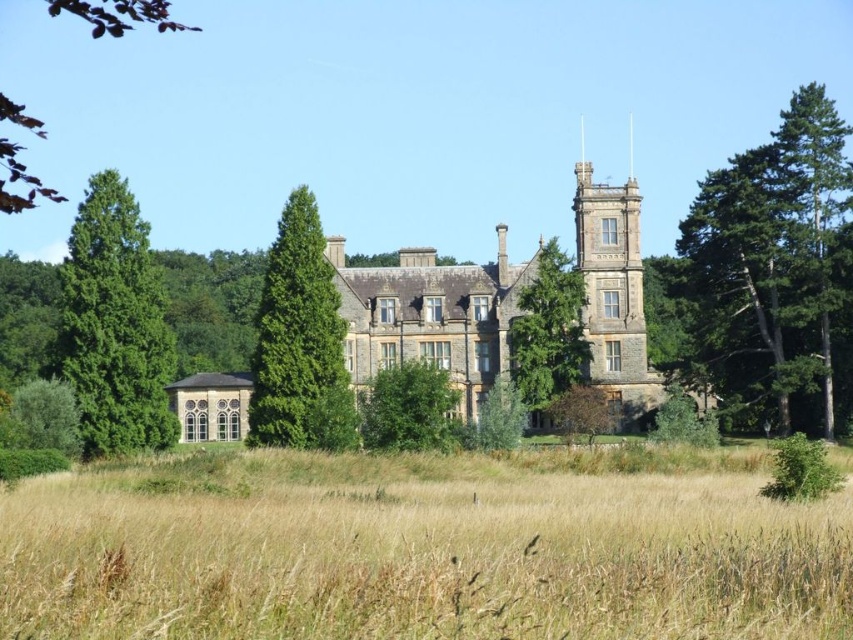
Which of these two, green textured tree at center-left or green textured tree at center, stands taller?

green textured tree at center-left is taller.

At what (x,y) coordinates should I click in order to perform the action: click on green textured tree at center-left. Please return your answer as a coordinate pair (x, y). The height and width of the screenshot is (640, 853). Looking at the image, I should click on (300, 340).

Which of these two, green textured pine tree at right or green textured tree at center, stands taller?

Standing taller between the two is green textured pine tree at right.

Is the position of green textured pine tree at right less distant than that of green textured tree at center?

No, green textured pine tree at right is further to the viewer.

Locate an element on the screen. Image resolution: width=853 pixels, height=640 pixels. green textured pine tree at right is located at coordinates (814, 211).

Who is higher up, green textured tree at upper left or green leafy tree at lower left?

green textured tree at upper left is above.

Does green textured tree at upper left have a smaller size compared to green leafy tree at lower left?

Actually, green textured tree at upper left might be larger than green leafy tree at lower left.

Locate an element on the screen. The width and height of the screenshot is (853, 640). green textured tree at upper left is located at coordinates (119, 13).